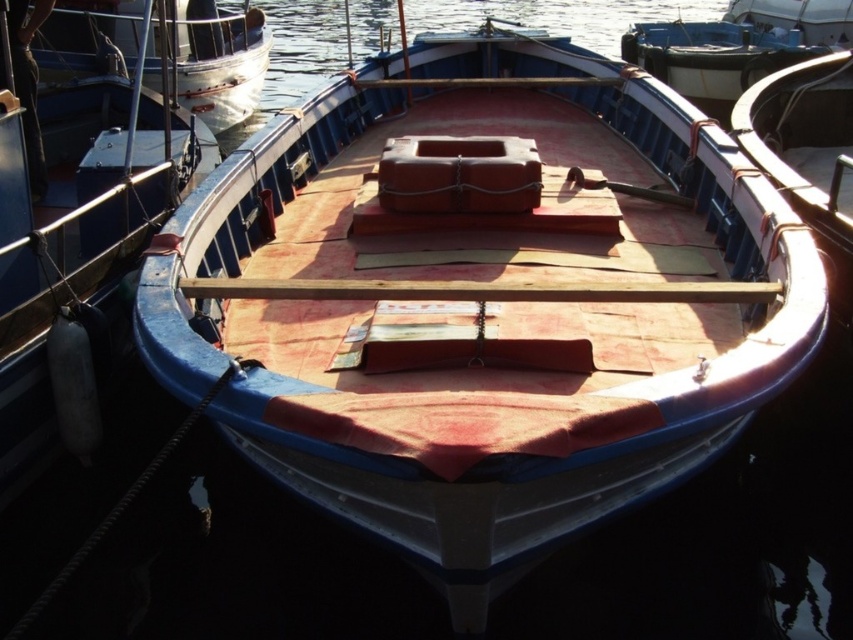
Can you confirm if matte blue boat at center is thinner than brushed metal boat at upper left?

Correct, matte blue boat at center's width is less than brushed metal boat at upper left's.

Does matte blue boat at center have a greater height compared to brushed metal boat at upper left?

In fact, matte blue boat at center may be shorter than brushed metal boat at upper left.

The height and width of the screenshot is (640, 853). In order to click on matte blue boat at center in this screenshot , I will do `click(84, 269)`.

Does matte blue boat at center lie behind clear water at center?

That is False.

Is matte blue boat at center smaller than clear water at center?

Correct, matte blue boat at center occupies less space than clear water at center.

The width and height of the screenshot is (853, 640). Find the location of `matte blue boat at center`. matte blue boat at center is located at coordinates (84, 269).

Locate an element on the screen. matte blue boat at center is located at coordinates (84, 269).

Who is shorter, clear water at center or brushed metal boat at upper left?

Standing shorter between the two is brushed metal boat at upper left.

Which is behind, point (422, 3) or point (154, 84)?

Positioned behind is point (422, 3).

Identify the location of clear water at center. This screenshot has width=853, height=640. [x=558, y=16].